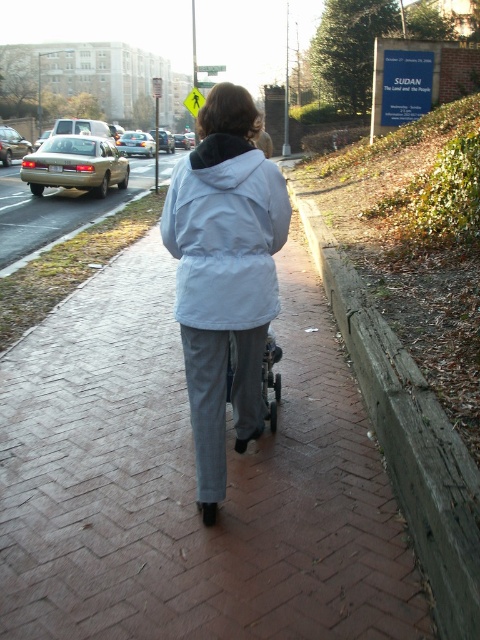
You are a delivery robot that needs to move from the road to the sidewalk. The brick pavement at center is the sidewalk, and the white matte jacket at center is the person. Can you safely navigate onto the sidewalk if your maximum climbing ability is 2 inches?

The brick pavement at center has a greater height compared to the white matte jacket at center. However, the height difference between the sidewalk and the road isn not specified. Without knowing the exact height of the brick pavement relative to the road, it is uncertain if the delivery robot can safely navigate onto the sidewalk with a 2 inch climbing ability.

You are standing at point (191, 483) in the image. What material are you standing on?

You are standing on brick pavement at center.